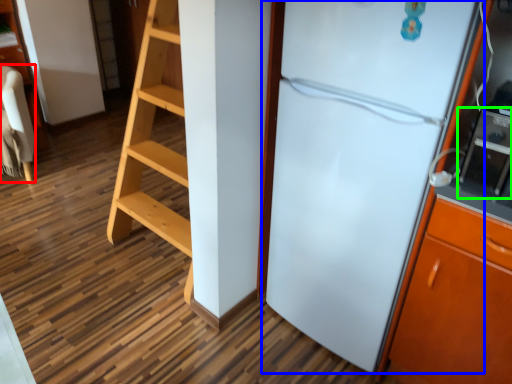
Question: Considering the real-world distances, which object is farthest from furniture (highlighted by a red box)? refrigerator (highlighted by a blue box) or appliance (highlighted by a green box)?

Choices:
 (A) refrigerator
 (B) appliance

Answer: (B)